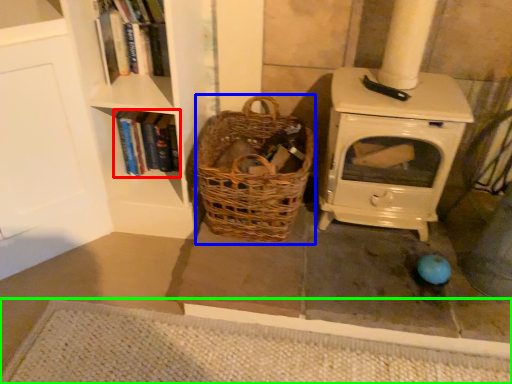
Question: Which object is positioned farthest from book (highlighted by a red box)? Select from basket (highlighted by a blue box) and doormat (highlighted by a green box).

Choices:
 (A) basket
 (B) doormat

Answer: (B)